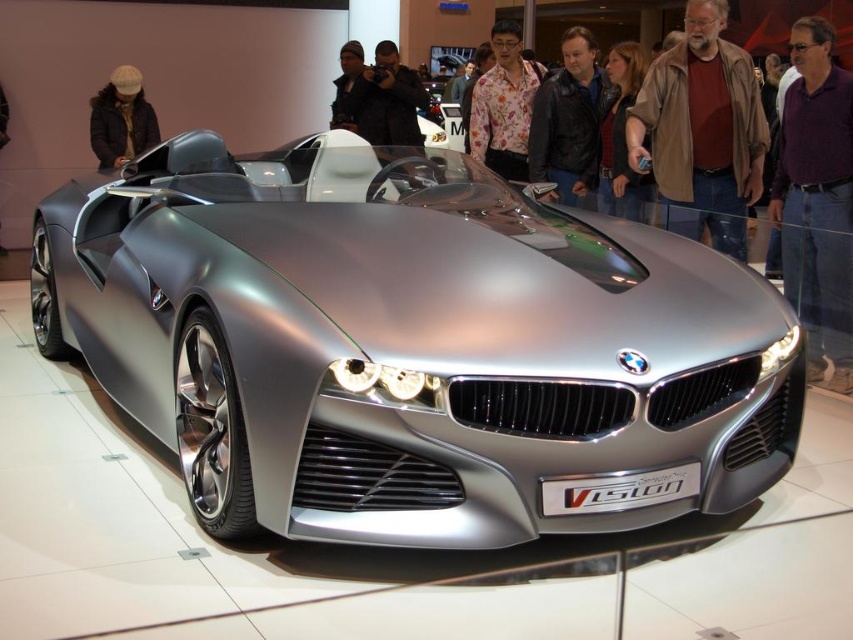
Question: Is satin silver car at center thinner than leather jacket at center?

Choices:
 (A) no
 (B) yes

Answer: (A)

Question: Estimate the real-world distances between objects in this image. Which object is farther from the knit cap at upper left?

Choices:
 (A) satin silver car at center
 (B) leather jacket at center
 (C) floral shirt at center
 (D) brown leather jacket at center

Answer: (D)

Question: Which object is positioned closest to the satin silver car at center?

Choices:
 (A) knit cap at upper left
 (B) leather jacket at center
 (C) floral shirt at center
 (D) brown leather jacket at center

Answer: (D)

Question: Can you confirm if leather jacket at center is smaller than floral shirt at center?

Choices:
 (A) yes
 (B) no

Answer: (A)

Question: Does brown leather jacket at center have a larger size compared to leather jacket at center?

Choices:
 (A) no
 (B) yes

Answer: (B)

Question: Which of the following is the closest to the observer?

Choices:
 (A) (560, 116)
 (B) (525, 108)
 (C) (120, 129)
 (D) (366, 378)

Answer: (D)